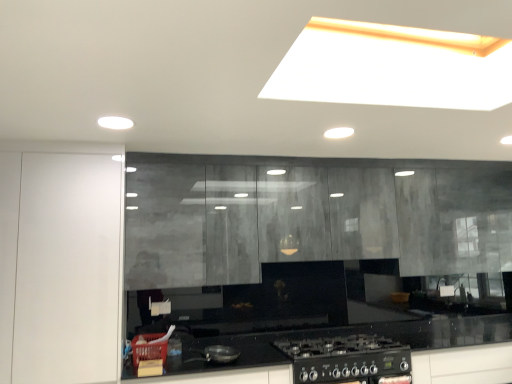
Question: Is the depth of white glossy cabinet at left less than that of matte concrete cabinets at center?

Choices:
 (A) yes
 (B) no

Answer: (A)

Question: Does white glossy cabinet at left have a lesser height compared to matte concrete cabinets at center?

Choices:
 (A) yes
 (B) no

Answer: (B)

Question: From the image's perspective, does white glossy cabinet at left appear lower than matte concrete cabinets at center?

Choices:
 (A) yes
 (B) no

Answer: (A)

Question: Considering the relative positions of white glossy cabinet at left and matte concrete cabinets at center in the image provided, is white glossy cabinet at left to the right of matte concrete cabinets at center from the viewer's perspective?

Choices:
 (A) no
 (B) yes

Answer: (A)

Question: Considering the relative sizes of white glossy cabinet at left and matte concrete cabinets at center in the image provided, is white glossy cabinet at left taller than matte concrete cabinets at center?

Choices:
 (A) no
 (B) yes

Answer: (B)

Question: Is white glossy cabinet at left to the left of matte concrete cabinets at center from the viewer's perspective?

Choices:
 (A) yes
 (B) no

Answer: (A)

Question: Could you tell me if matte concrete cabinets at center is turned towards white glossy cabinet at left?

Choices:
 (A) yes
 (B) no

Answer: (B)

Question: Considering the relative sizes of matte concrete cabinets at center and white glossy cabinet at left in the image provided, is matte concrete cabinets at center thinner than white glossy cabinet at left?

Choices:
 (A) yes
 (B) no

Answer: (A)

Question: Can you confirm if matte concrete cabinets at center is shorter than white glossy cabinet at left?

Choices:
 (A) no
 (B) yes

Answer: (B)

Question: From the image's perspective, is matte concrete cabinets at center above white glossy cabinet at left?

Choices:
 (A) no
 (B) yes

Answer: (B)

Question: Considering the relative sizes of matte concrete cabinets at center and white glossy cabinet at left in the image provided, is matte concrete cabinets at center smaller than white glossy cabinet at left?

Choices:
 (A) no
 (B) yes

Answer: (A)

Question: Are matte concrete cabinets at center and white glossy cabinet at left located far from each other?

Choices:
 (A) no
 (B) yes

Answer: (A)

Question: From a real-world perspective, is white glossy cabinet at left positioned above or below matte concrete cabinets at center?

Choices:
 (A) below
 (B) above

Answer: (A)